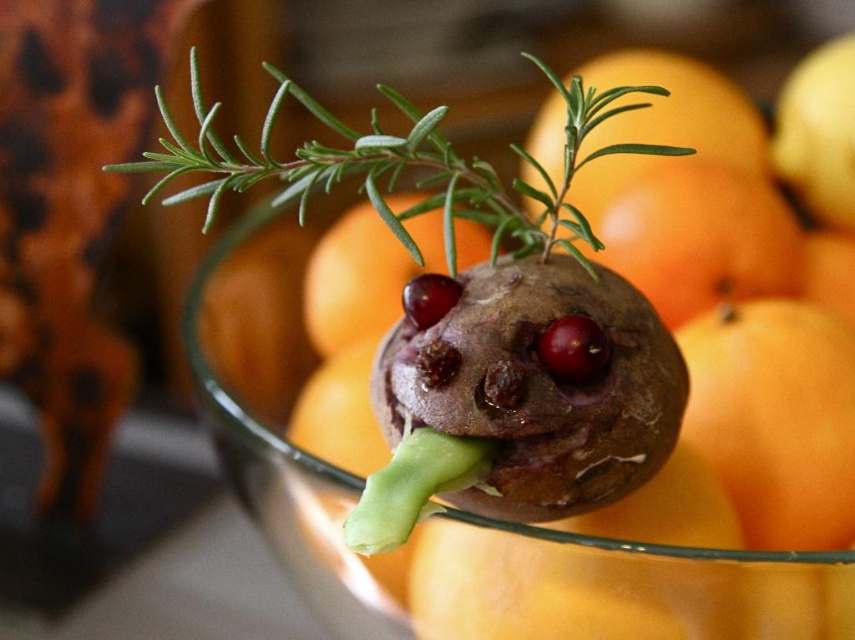
Between glossy orange at center and shiny red cherry at center, which one is positioned higher?

glossy orange at center

Is glossy orange at center taller than shiny red cherry at center?

Indeed, glossy orange at center has a greater height compared to shiny red cherry at center.

Between point (397, 259) and point (602, 365), which one is positioned behind?

The point (397, 259) is more distant.

The height and width of the screenshot is (640, 855). Identify the location of glossy orange at center. (364, 275).

Where is `green leafy rosemary at upper center`? green leafy rosemary at upper center is located at coordinates (401, 166).

Does point (587, 244) come in front of point (596, 104)?

No, (587, 244) is further to viewer.

At what (x,y) coordinates should I click in order to perform the action: click on green leafy rosemary at upper center. Please return your answer as a coordinate pair (x, y). Looking at the image, I should click on (401, 166).

Is point (688, 593) positioned after point (498, 243)?

No, it is in front of (498, 243).

Is transparent glass bowl at center wider than green leafy rosemary at upper center?

No, transparent glass bowl at center is not wider than green leafy rosemary at upper center.

Between point (382, 596) and point (155, 193), which one is positioned in front?

Point (155, 193) is in front.

Find the location of a particular element. This screenshot has width=855, height=640. transparent glass bowl at center is located at coordinates (280, 432).